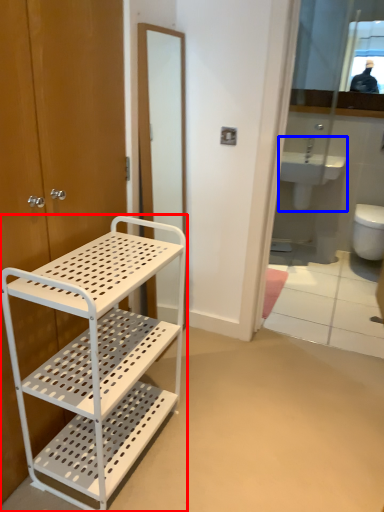
Question: Which point is further to the camera, bathroom cabinet (highlighted by a red box) or sink (highlighted by a blue box)?

Choices:
 (A) bathroom cabinet
 (B) sink

Answer: (B)